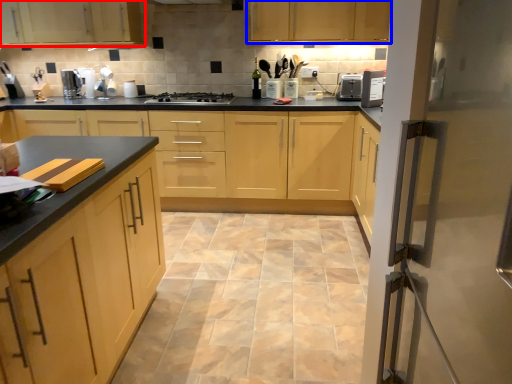
Question: Which point is further to the camera, cabinetry (highlighted by a red box) or cabinetry (highlighted by a blue box)?

Choices:
 (A) cabinetry
 (B) cabinetry

Answer: (A)